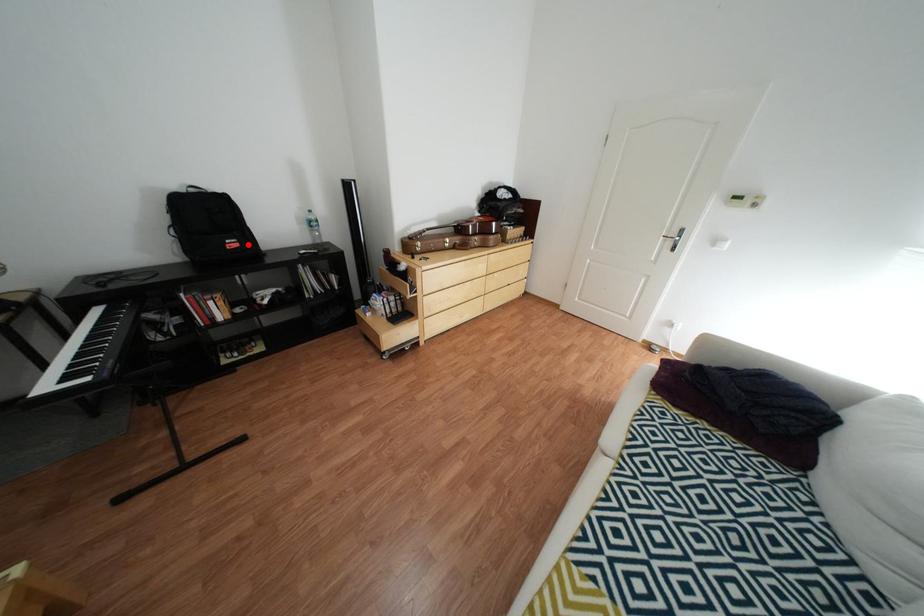
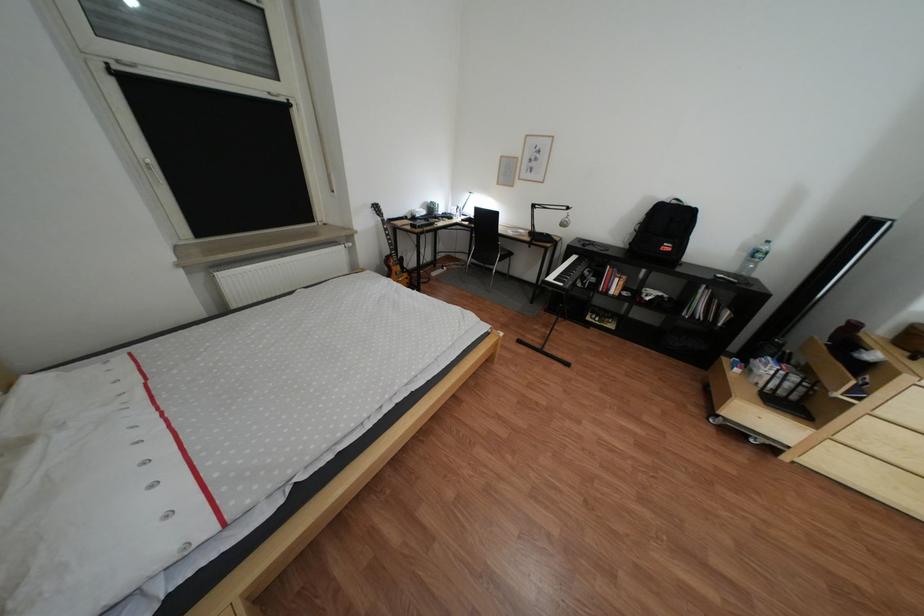
Question: A red point is marked in image1. In image2, is the corresponding 3D point closer to the camera or farther? Reply with the corresponding letter.

Choices:
 (A) The corresponding 3D point is closer.
 (B) The corresponding 3D point is farther.

Answer: (B)